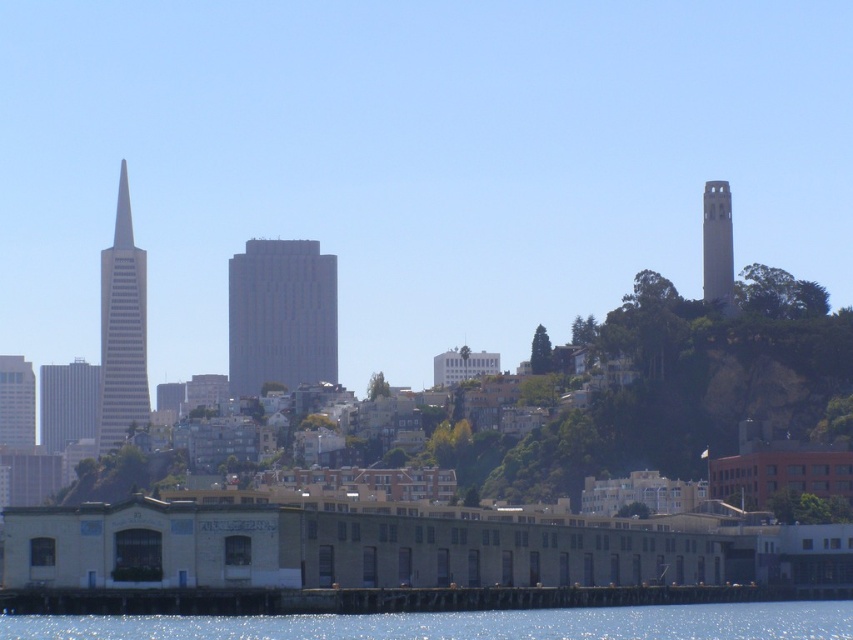
Question: Which object is farther from the camera taking this photo?

Choices:
 (A) clear water at lower center
 (B) smooth concrete tower at upper right

Answer: (B)

Question: Is gray concrete building at center above gray glass skyscraper at left?

Choices:
 (A) no
 (B) yes

Answer: (A)

Question: Does gray concrete building at center come behind gray glass skyscraper at left?

Choices:
 (A) no
 (B) yes

Answer: (A)

Question: Among these objects, which one is nearest to the camera?

Choices:
 (A) smooth glass spire at upper left
 (B) clear water at lower center
 (C) matte gray skyscraper at left

Answer: (B)

Question: Does smooth concrete tower at upper right appear on the left side of smooth glass spire at upper left?

Choices:
 (A) yes
 (B) no

Answer: (B)

Question: Which point is closer to the camera?

Choices:
 (A) clear water at lower center
 (B) smooth concrete tower at upper right
 (C) smooth glass spire at upper left
 (D) matte gray skyscraper at left

Answer: (A)